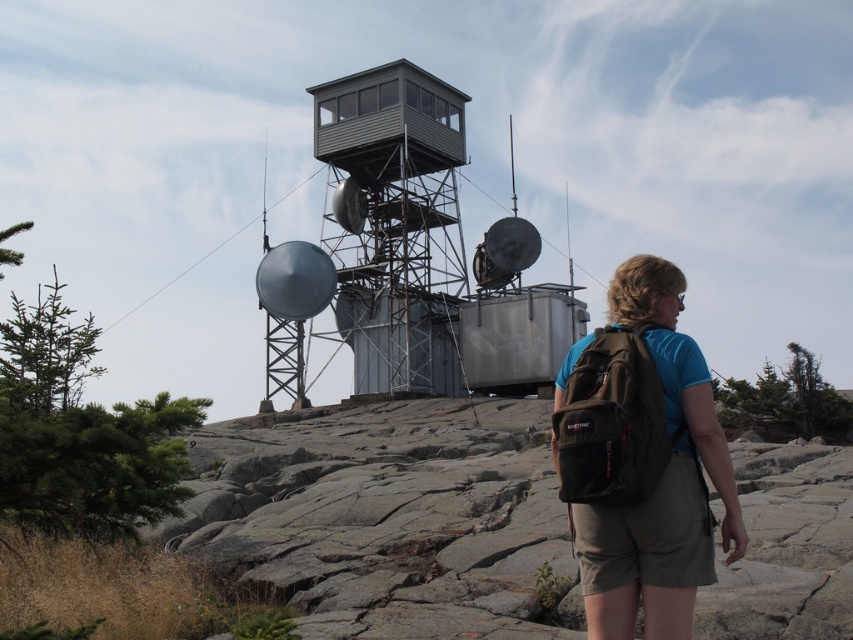
Wait, the objects are the same? Let me check the input again. Oh, the user might have made a typo. The first object is labeled as metallic gray observation tower at center, and the second is gray metallic observation tower at center. They are slightly different in wording but refer to the same structure. Hmm, how should I handle this? The rules state to mention all object labels exactly as given. So I need to include both in the question even though they seem identical. Maybe the user intended two different

The user likely intended to list two separate objects but made a typo. The two object labels are nearly identical except for the word order. Since they are the same structure, the description stating one is under the other is impossible. This might be an error in the input. However, following the rules strictly, the answer must use the provided description. The description says the first is under the second, so the answer would reflect that despite the inconsistency.

You are a hiker who just finished setting up camp. You have a brown fabric backpack at right and a gray metallic observation tower at center in your view. Which item takes up more area in your field of view?

The gray metallic observation tower at center occupies more space than the brown fabric backpack at right, so the observation tower takes up more area in your field of view.

You are a hiker who has just reached the top of a mountain. You see the brown fabric backpack at right. If you want to place a marker at the exact center of the backpack, what are the coordinates of that point?

The exact center of the brown fabric backpack at right is located at coordinates point (641, 458).